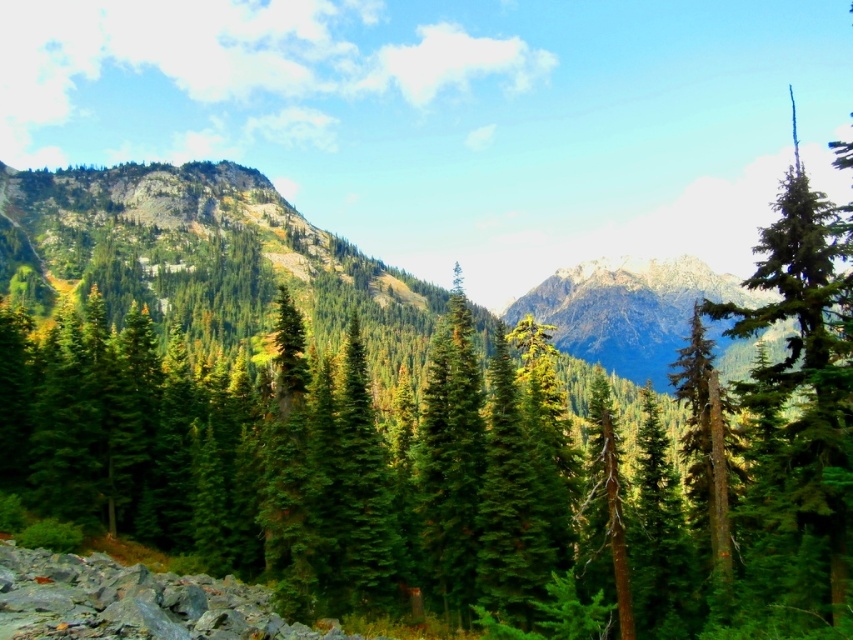
Question: Is green forested mountain at center closer to the viewer compared to green matte tree at right?

Choices:
 (A) no
 (B) yes

Answer: (A)

Question: Which of the following is the closest to the observer?

Choices:
 (A) (228, 225)
 (B) (821, 285)
 (C) (642, 273)

Answer: (B)

Question: Among these objects, which one is farthest from the camera?

Choices:
 (A) snowy rocky mountain at center
 (B) green matte tree at right
 (C) green forested mountain at center

Answer: (C)

Question: Which of these objects is positioned closest to the green matte tree at right?

Choices:
 (A) green forested mountain at center
 (B) snowy rocky mountain at center

Answer: (A)

Question: Is green matte tree at right to the right of snowy rocky mountain at center from the viewer's perspective?

Choices:
 (A) no
 (B) yes

Answer: (B)

Question: Is green matte tree at right below snowy rocky mountain at center?

Choices:
 (A) yes
 (B) no

Answer: (B)